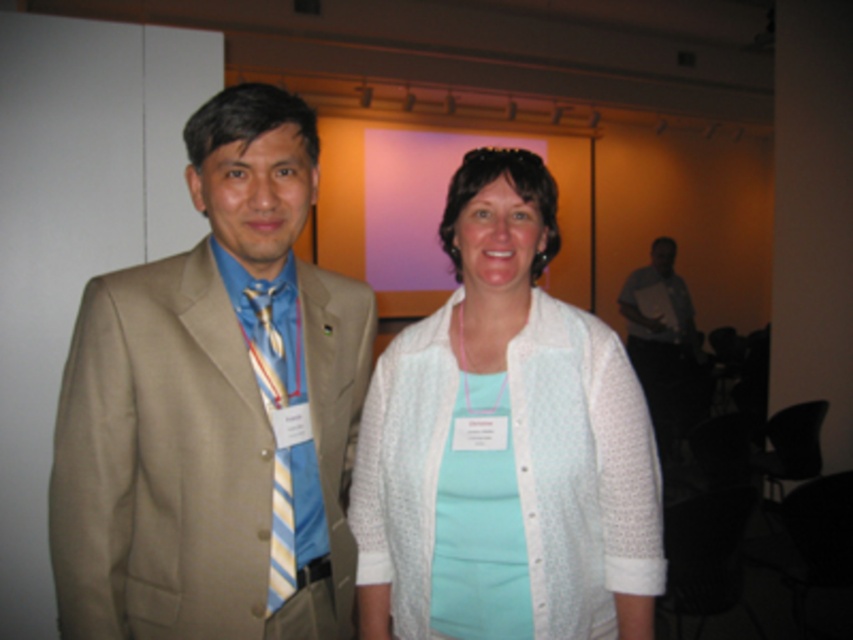
You are a photographer adjusting the lighting for a portrait. You notice the white textured cardigan at center and the matte white neck at center. Which object should you focus on to ensure proper exposure since it is closer to the camera?

The matte white neck at center is closer to the camera than the white textured cardigan at center, so you should focus on the matte white neck at center to ensure proper exposure.

You are a photographer adjusting the focus on a camera. You need to ensure that the matte white neck at center is in sharp focus. Given that the camera can only focus precisely at a single point, which coordinate should you aim the focus point at?

The matte white neck at center is located at coordinate point (x=495, y=298), so you should aim the focus point at that location to ensure it is in sharp focus.